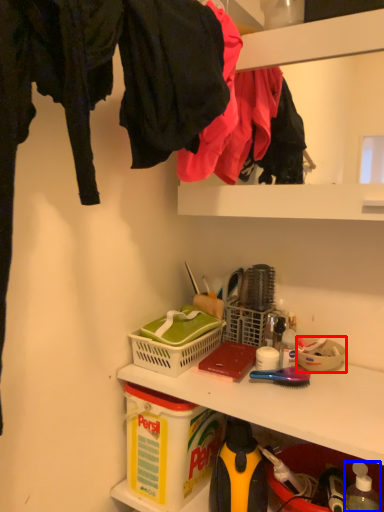
Question: Which object appears closest to the camera in this image, bowl (highlighted by a red box) or bottle (highlighted by a blue box)?

Choices:
 (A) bowl
 (B) bottle

Answer: (B)